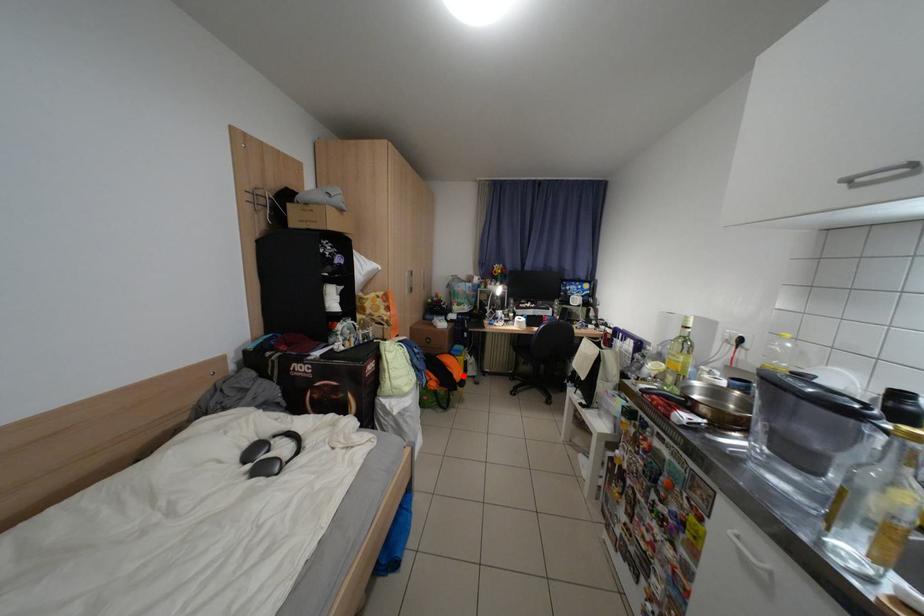
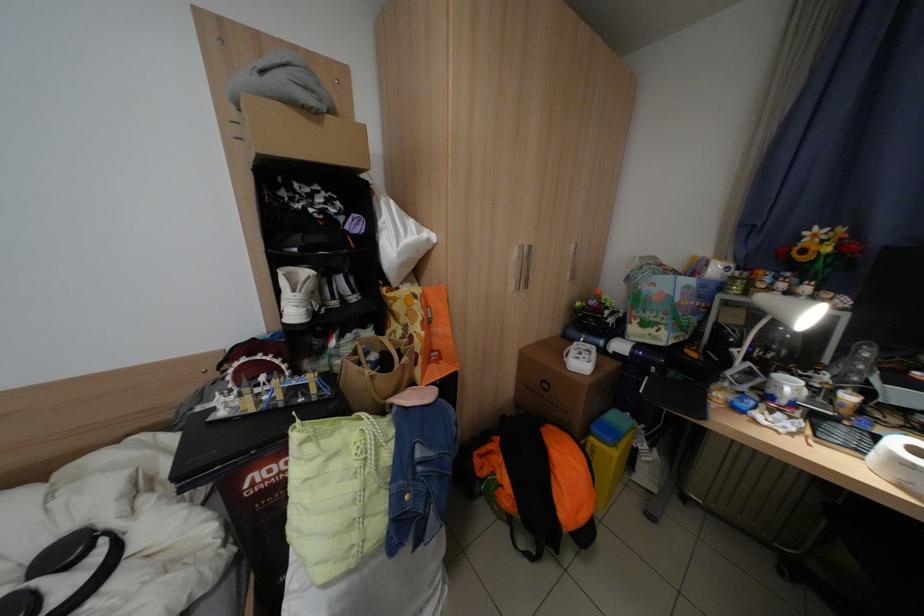
Find the pixel in the second image that matches the highlighted location in the first image.

(565, 508)